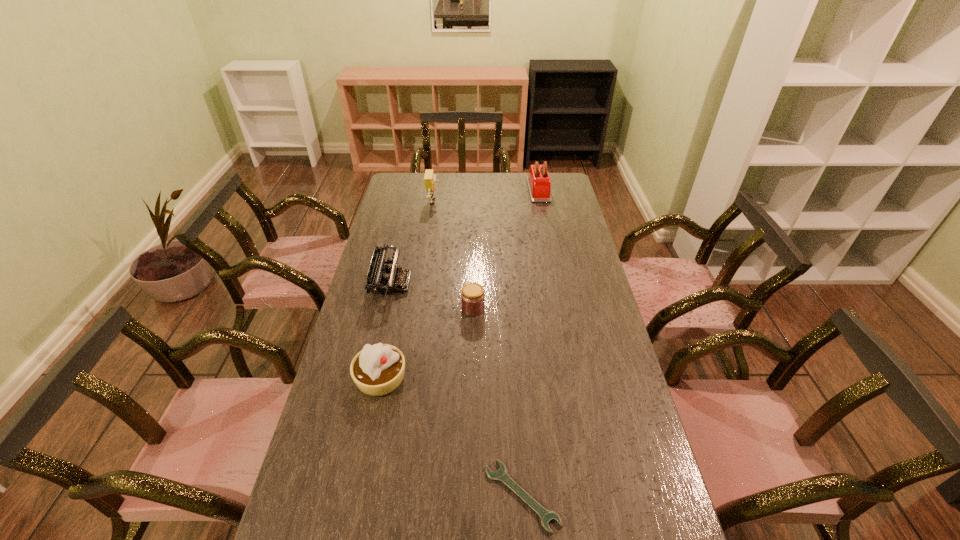
At what (x,y) coordinates should I click in order to perform the action: click on vacant area located on the typing side of the typewriter. Please return your answer as a coordinate pair (x, y). Looking at the image, I should click on (441, 284).

At what (x,y) coordinates should I click in order to perform the action: click on vacant space located 0.400m on the right of the second shortest object. Please return your answer as a coordinate pair (x, y). The image size is (960, 540). Looking at the image, I should click on (596, 308).

Find the location of `vacant space positioned on the back of the shortest object`. vacant space positioned on the back of the shortest object is located at coordinates (514, 376).

Where is `sponge at the far edge`? sponge at the far edge is located at coordinates (430, 178).

Locate an element on the screen. The width and height of the screenshot is (960, 540). toaster present at the far edge is located at coordinates (539, 184).

This screenshot has height=540, width=960. I want to click on whipped cream that is at the left edge, so click(x=378, y=369).

In order to click on typewriter that is at the left edge in this screenshot , I will do `click(380, 279)`.

This screenshot has height=540, width=960. I want to click on object that is at the right edge, so click(539, 184).

This screenshot has height=540, width=960. Identify the location of object situated at the far right corner. (539, 184).

Where is `free space at the left edge of the desktop`? This screenshot has height=540, width=960. free space at the left edge of the desktop is located at coordinates (414, 236).